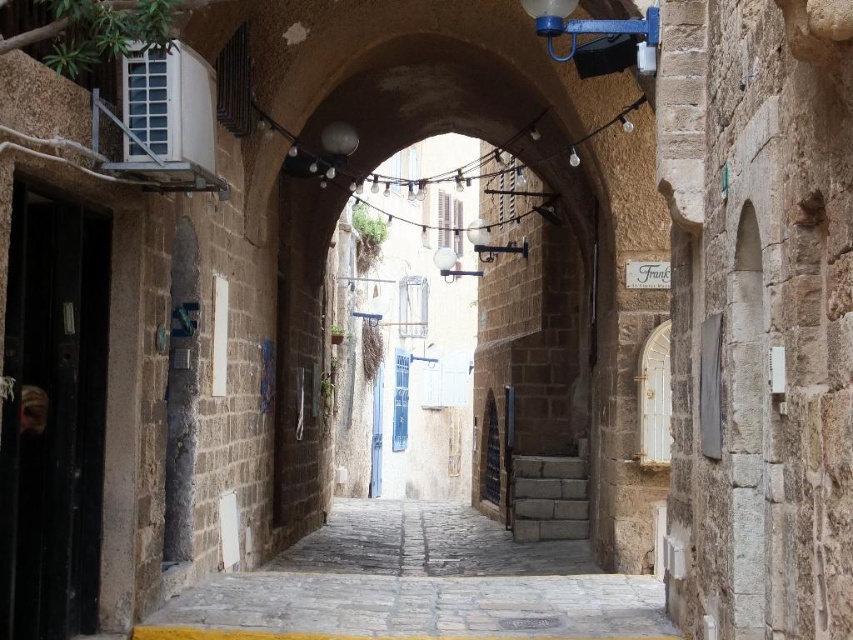
You are a tour guide leading a group through a historic town. You want to ensure everyone can walk comfortably between the brown stone archway at center and the stone paved alley at center. The widest person in your group is 2.5 feet wide. Is there enough space for them to pass through comfortably?

The distance between the brown stone archway at center and the stone paved alley at center is 48.45 feet, which is significantly wider than the 2.5 feet width of the widest person. Therefore, there is ample space for them to pass through comfortably.